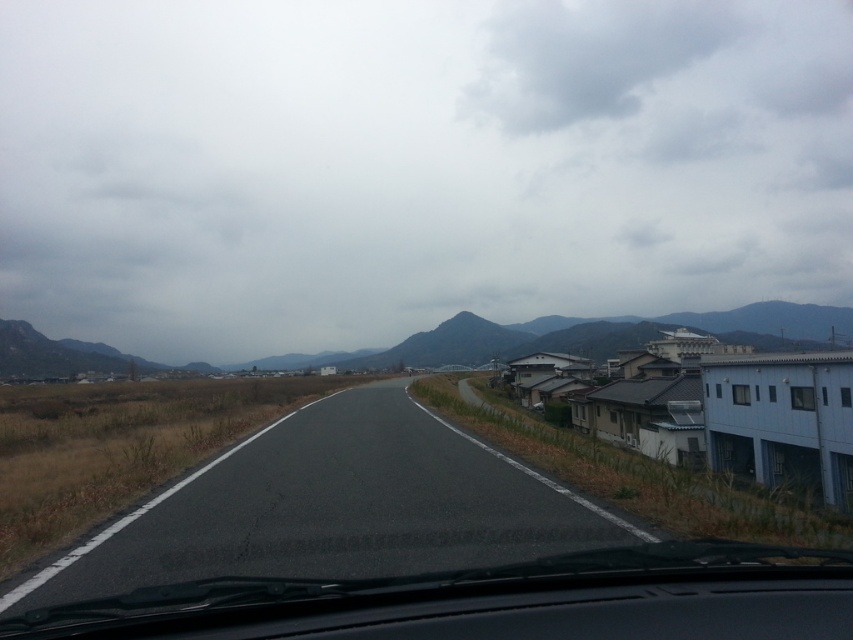
You are a passenger in the car and want to see the road ahead. Which object is closer to you, the asphalt road at center or the transparent glass windshield at center?

The asphalt road at center is located below the transparent glass windshield at center, so the transparent glass windshield at center is closer to you.